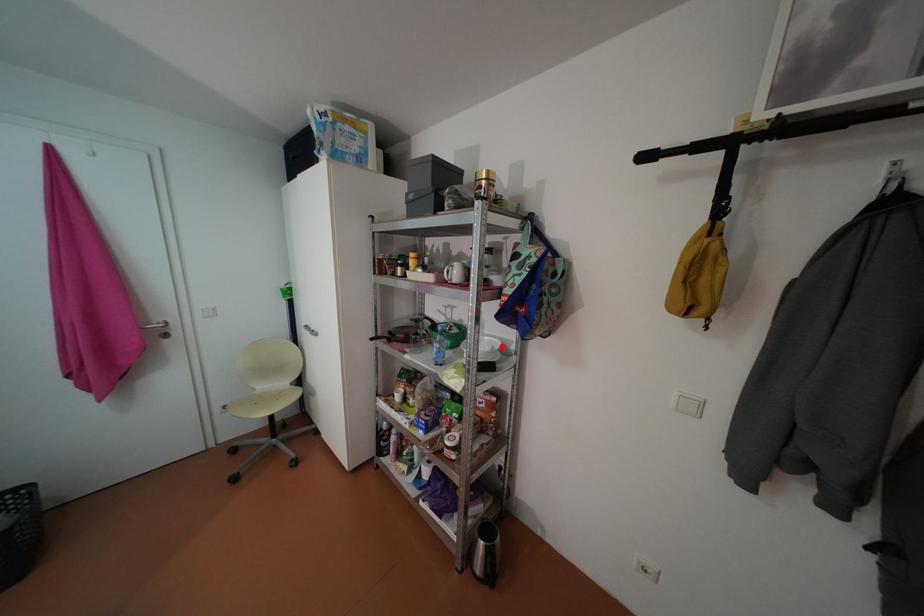
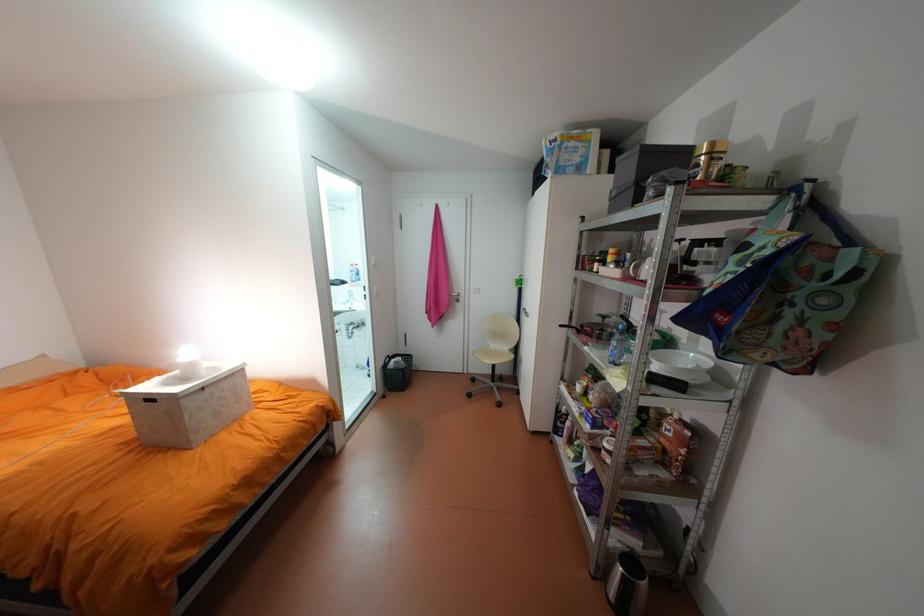
The point at the highlighted location is marked in the first image. Where is the corresponding point in the second image?

(707, 367)